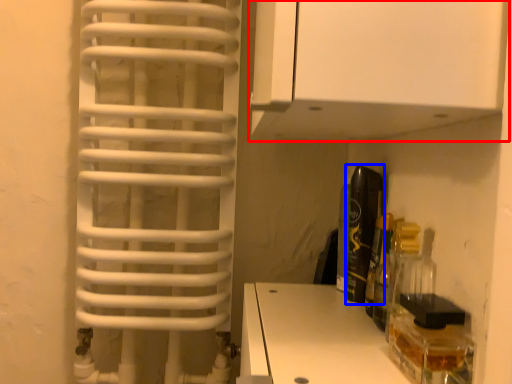
Question: Which point is further to the camera, cabinetry (highlighted by a red box) or bottle (highlighted by a blue box)?

Choices:
 (A) cabinetry
 (B) bottle

Answer: (B)